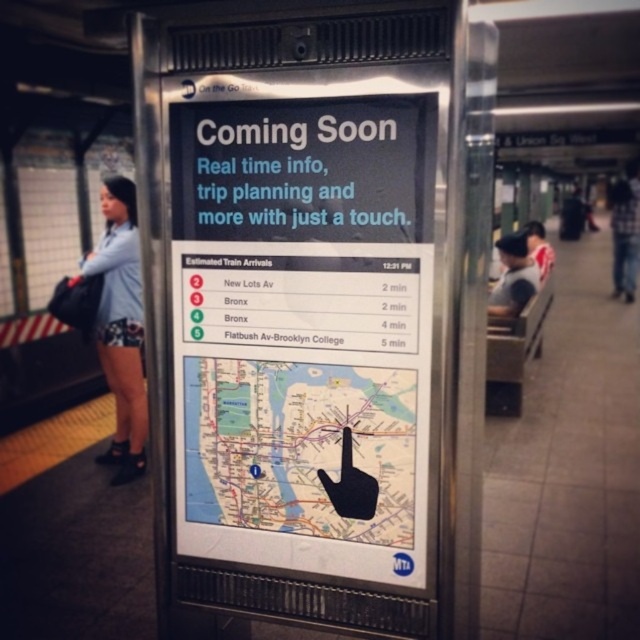
You are standing on the subway platform and want to check the Estimated Train Arrivals board. There are two points marked on the platform. One is at point (211,458) and the other at point (532,273). Which point is closer to the Estimated Train Arrivals board?

Point (211,458) is in front of point (532,273), so it is closer to the Estimated Train Arrivals board.

You are waiting at the subway station platform and see the matte map at center and denim shorts at left. Which object is positioned lower on the platform?

The matte map at center is positioned lower than the denim shorts at left because it is located below it.

You are standing on the subway station platform and want to find the location of the matte map at center. Where is it located in relation to the advertisement?

The matte map at center is located below the advertisement on the metallic pillar.